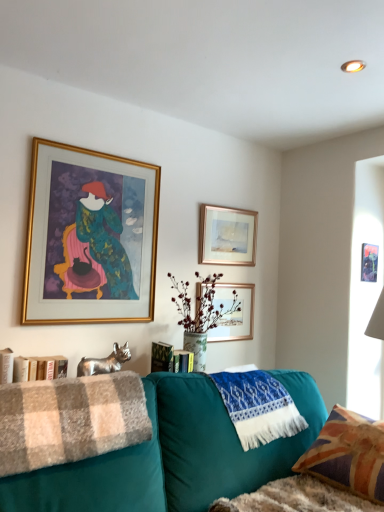
Question: Does union jack fabric pillow at lower right come behind gold-framed picture at upper center, which is counted as the third picture frame, starting from the left?

Choices:
 (A) yes
 (B) no

Answer: (B)

Question: Considering the relative sizes of union jack fabric pillow at lower right and gold-framed picture at upper center, which is the 2th picture frame in right-to-left order, in the image provided, is union jack fabric pillow at lower right taller than gold-framed picture at upper center, which is the 2th picture frame in right-to-left order,?

Choices:
 (A) no
 (B) yes

Answer: (B)

Question: Is the surface of union jack fabric pillow at lower right in direct contact with gold-framed picture at upper center, which is counted as the third picture frame, starting from the left?

Choices:
 (A) no
 (B) yes

Answer: (A)

Question: Can you confirm if union jack fabric pillow at lower right is thinner than gold-framed picture at upper center, which is counted as the third picture frame, starting from the left?

Choices:
 (A) no
 (B) yes

Answer: (A)

Question: Is union jack fabric pillow at lower right oriented away from gold-framed picture at upper center, which is counted as the third picture frame, starting from the left?

Choices:
 (A) no
 (B) yes

Answer: (A)

Question: From a real-world perspective, is union jack fabric pillow at lower right over gold-framed picture at upper center, which is the 2th picture frame in right-to-left order?

Choices:
 (A) no
 (B) yes

Answer: (A)

Question: Is metallic gold picture frame at upper center, the first picture frame viewed from the right, bigger than union jack fabric pillow at lower right?

Choices:
 (A) no
 (B) yes

Answer: (A)

Question: Does metallic gold picture frame at upper center, the first picture frame viewed from the right, turn towards union jack fabric pillow at lower right?

Choices:
 (A) no
 (B) yes

Answer: (A)

Question: Is metallic gold picture frame at upper center, the first picture frame viewed from the right, with union jack fabric pillow at lower right?

Choices:
 (A) no
 (B) yes

Answer: (A)

Question: From the image's perspective, is metallic gold picture frame at upper center, the first picture frame viewed from the right, beneath union jack fabric pillow at lower right?

Choices:
 (A) no
 (B) yes

Answer: (A)

Question: Is there a large distance between metallic gold picture frame at upper center, marked as the fourth picture frame in a left-to-right arrangement, and union jack fabric pillow at lower right?

Choices:
 (A) yes
 (B) no

Answer: (A)

Question: Can you confirm if metallic gold picture frame at upper center, the first picture frame viewed from the right, is thinner than union jack fabric pillow at lower right?

Choices:
 (A) yes
 (B) no

Answer: (A)

Question: Does union jack fabric pillow at lower right appear on the left side of gold-framed picture at upper center, which ranks as the 2th picture frame in left-to-right order?

Choices:
 (A) no
 (B) yes

Answer: (A)